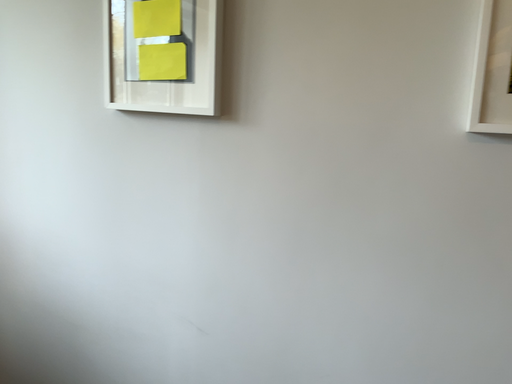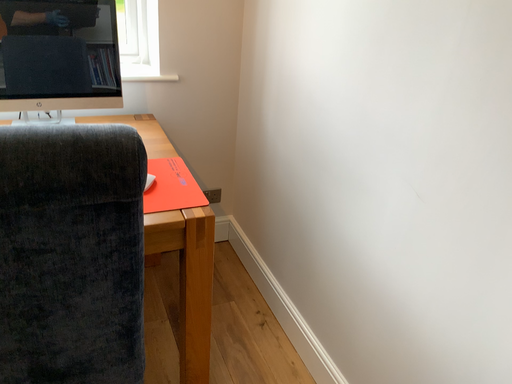
Question: How did the camera likely rotate when shooting the video?

Choices:
 (A) rotated right
 (B) rotated left

Answer: (B)